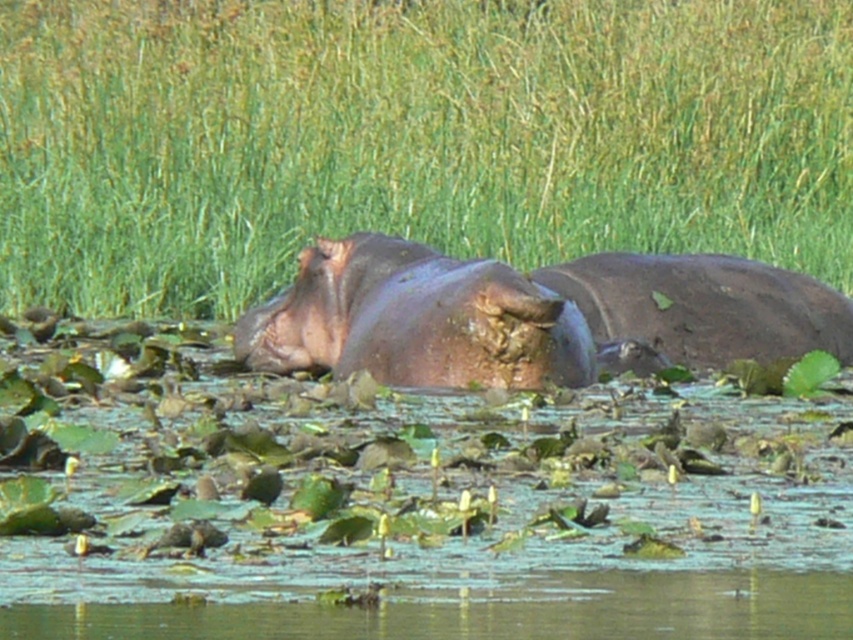
Question: Can you confirm if clear water at lower center is positioned to the right of muddy skin hippo at center?

Choices:
 (A) no
 (B) yes

Answer: (B)

Question: Is clear water at lower center bigger than muddy skin hippo at center?

Choices:
 (A) no
 (B) yes

Answer: (A)

Question: Where is green grass at upper center located in relation to brown matte hippo at center in the image?

Choices:
 (A) right
 (B) left

Answer: (B)

Question: Based on their relative distances, which object is farther from the clear water at lower center?

Choices:
 (A) green grass at upper center
 (B) muddy skin hippo at center

Answer: (A)

Question: Among these objects, which one is nearest to the camera?

Choices:
 (A) clear water at lower center
 (B) brown matte hippo at center
 (C) green grass at upper center

Answer: (A)

Question: Which point is closer to the camera taking this photo?

Choices:
 (A) (x=256, y=204)
 (B) (x=778, y=273)
 (C) (x=184, y=627)

Answer: (C)